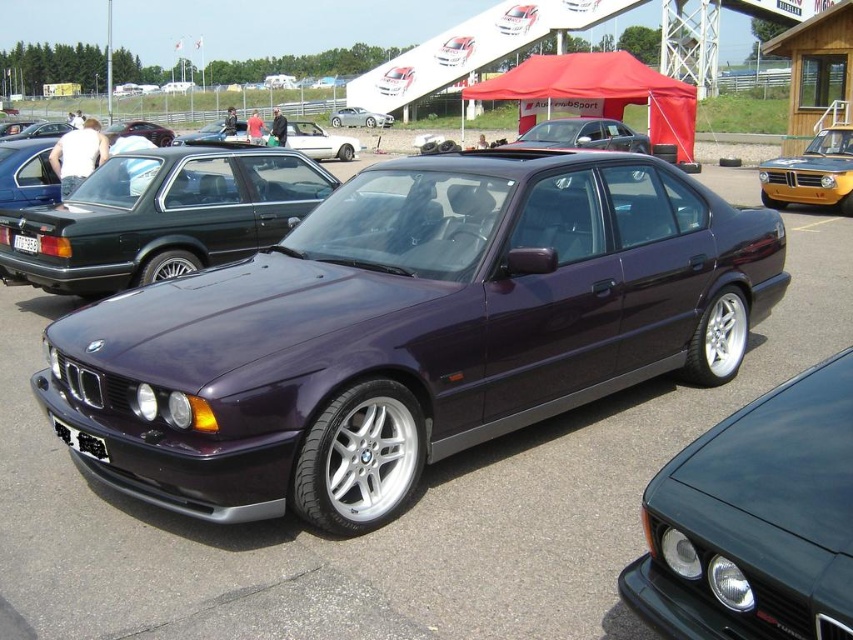
You are standing at the center of the car show and see the point marked at coordinates (410,330). Which object in the scene is this point located on?

The point marked at coordinates (410,330) is located on the purple metallic car at center.